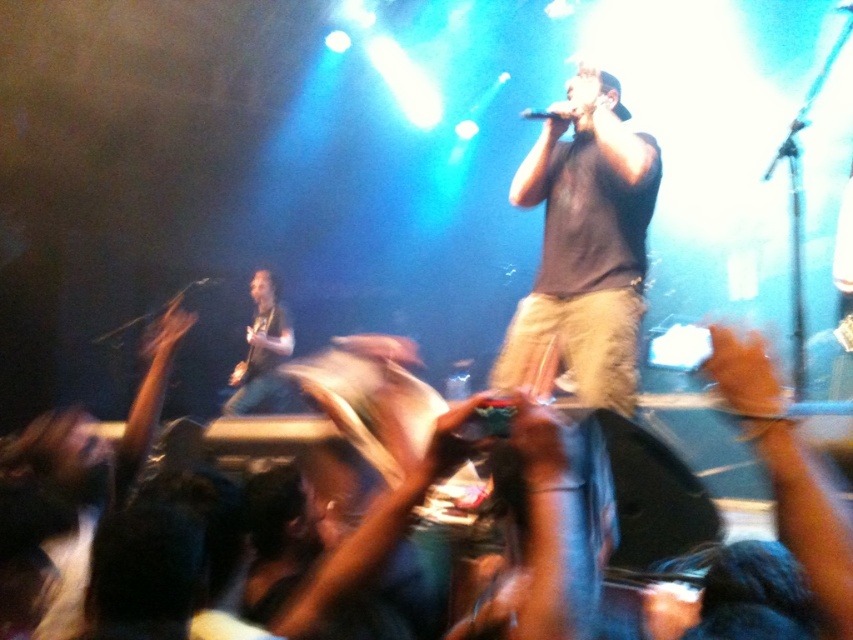
What is located at the point with coordinates (584, 248)?

The black cotton shirt at center is located at point (584, 248).

You are at the concert and want to take a photo of the point at coordinates [492,368]. Your camera has a maximum focus range of 7 meters. Will your camera be able to focus on that point?

The point at coordinates [492,368] is 7.27 meters from the camera, which exceeds the camera maximum focus range of 7 meters. Therefore, the camera cannot focus on that point.